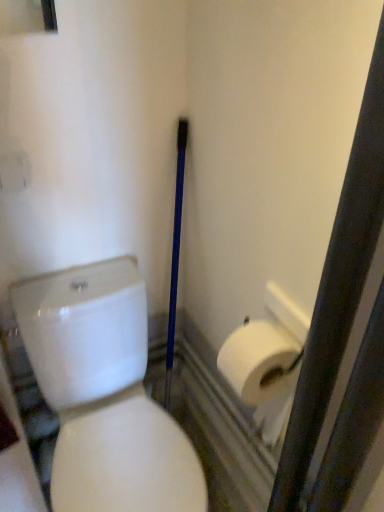
What do you see at coordinates (262, 372) in the screenshot? I see `white matte toilet paper at right` at bounding box center [262, 372].

Image resolution: width=384 pixels, height=512 pixels. Find the location of `white matte toilet paper at right`. white matte toilet paper at right is located at coordinates (262, 372).

I want to click on white glossy toilet at center, so 104,393.

Describe the element at coordinates (104, 393) in the screenshot. I see `white glossy toilet at center` at that location.

Image resolution: width=384 pixels, height=512 pixels. I want to click on white matte toilet paper at right, so click(x=262, y=372).

Can you confirm if white glossy toilet at center is positioned to the right of white matte toilet paper at right?

No.

Looking at this image, is white glossy toilet at center in front of or behind white matte toilet paper at right in the image?

Visually, white glossy toilet at center is located in front of white matte toilet paper at right.

Which is behind, point (82, 404) or point (252, 399)?

Point (82, 404)

From the image's perspective, between white glossy toilet at center and white matte toilet paper at right, who is located below?

white glossy toilet at center appears lower in the image.

From a real-world perspective, is white glossy toilet at center below white matte toilet paper at right?

Yes, from a real-world perspective, white glossy toilet at center is beneath white matte toilet paper at right.

Which object is thinner, white glossy toilet at center or white matte toilet paper at right?

Thinner between the two is white matte toilet paper at right.

Which of these two, white glossy toilet at center or white matte toilet paper at right, stands taller?

white glossy toilet at center.

Does white glossy toilet at center have a smaller size compared to white matte toilet paper at right?

No, white glossy toilet at center is not smaller than white matte toilet paper at right.

Is white matte toilet paper at right located within white glossy toilet at center?

No, white glossy toilet at center does not contain white matte toilet paper at right.

Would you consider white glossy toilet at center to be distant from white matte toilet paper at right?

No, white glossy toilet at center is in close proximity to white matte toilet paper at right.

Looking at this image, could you tell me if white glossy toilet at center is facing white matte toilet paper at right?

No, white glossy toilet at center is not oriented towards white matte toilet paper at right.

How different are the orientations of white glossy toilet at center and white matte toilet paper at right in degrees?

The facing directions of white glossy toilet at center and white matte toilet paper at right are 89.5 degrees apart.

Locate an element on the screen. toilet paper on the right side of white glossy toilet at center is located at coordinates (262, 372).

In the scene shown: Which is more to the right, white matte toilet paper at right or white glossy toilet at center?

Positioned to the right is white matte toilet paper at right.

Is white matte toilet paper at right further to the viewer compared to white glossy toilet at center?

Yes, white matte toilet paper at right is further from the camera.

Considering the points (275, 373) and (183, 490), which point is in front, point (275, 373) or point (183, 490)?

The point (275, 373) is more forward.

From the image's perspective, is white matte toilet paper at right located beneath white glossy toilet at center?

Actually, white matte toilet paper at right appears above white glossy toilet at center in the image.

From the picture: From a real-world perspective, is white matte toilet paper at right positioned under white glossy toilet at center based on gravity?

Incorrect, from a real-world perspective, white matte toilet paper at right is higher than white glossy toilet at center.

Is white matte toilet paper at right wider or thinner than white glossy toilet at center?

In the image, white matte toilet paper at right appears to be more narrow than white glossy toilet at center.

Looking at this image, can you confirm if white matte toilet paper at right is taller than white glossy toilet at center?

Incorrect, the height of white matte toilet paper at right is not larger of that of white glossy toilet at center.

Is white matte toilet paper at right bigger or smaller than white glossy toilet at center?

Clearly, white matte toilet paper at right is smaller in size than white glossy toilet at center.

Would you say white matte toilet paper at right is inside or outside white glossy toilet at center?

white matte toilet paper at right is not enclosed by white glossy toilet at center.

Are white matte toilet paper at right and white glossy toilet at center making contact?

white matte toilet paper at right is not next to white glossy toilet at center, and they're not touching.

Could you tell me if white matte toilet paper at right is facing white glossy toilet at center?

Yes, white matte toilet paper at right is oriented towards white glossy toilet at center.

Locate an element on the screen. This screenshot has width=384, height=512. porcelain that is on the left side of white matte toilet paper at right is located at coordinates (104, 393).

In order to click on porcelain located underneath the white matte toilet paper at right (from a real-world perspective) in this screenshot , I will do `click(104, 393)`.

Where is `porcelain in front of the white matte toilet paper at right`? porcelain in front of the white matte toilet paper at right is located at coordinates (104, 393).